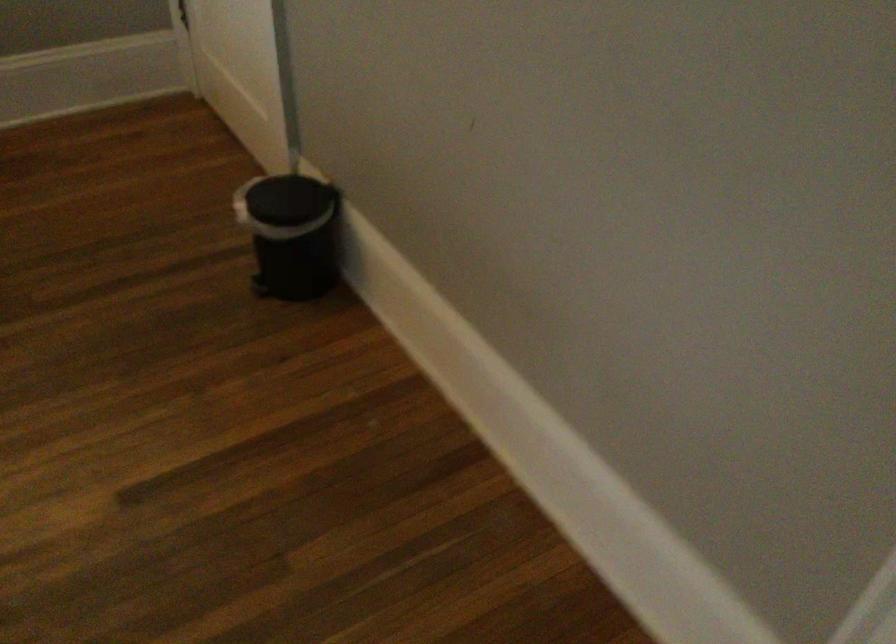
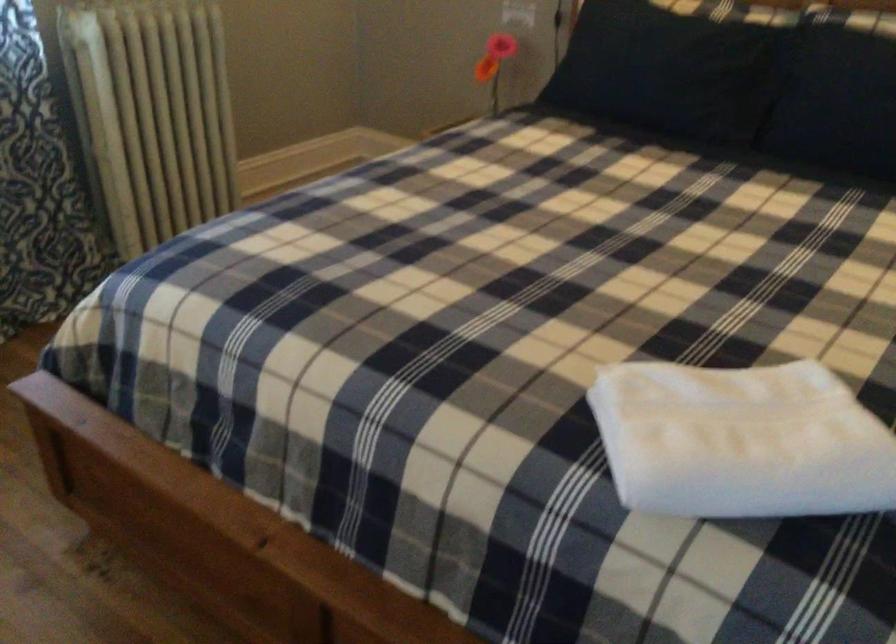
Question: The camera is either moving clockwise (left) or counter-clockwise (right) around the object. The first image is from the beginning of the video and the second image is from the end. Is the camera moving left or right when shooting the video?

Choices:
 (A) Left
 (B) Right

Answer: (B)